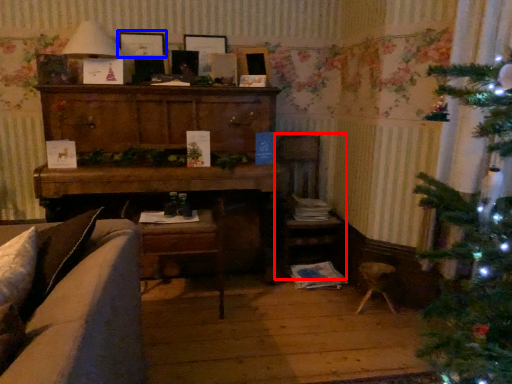
Question: Which of the following is the farthest to the observer, armchair (highlighted by a red box) or picture frame (highlighted by a blue box)?

Choices:
 (A) armchair
 (B) picture frame

Answer: (B)